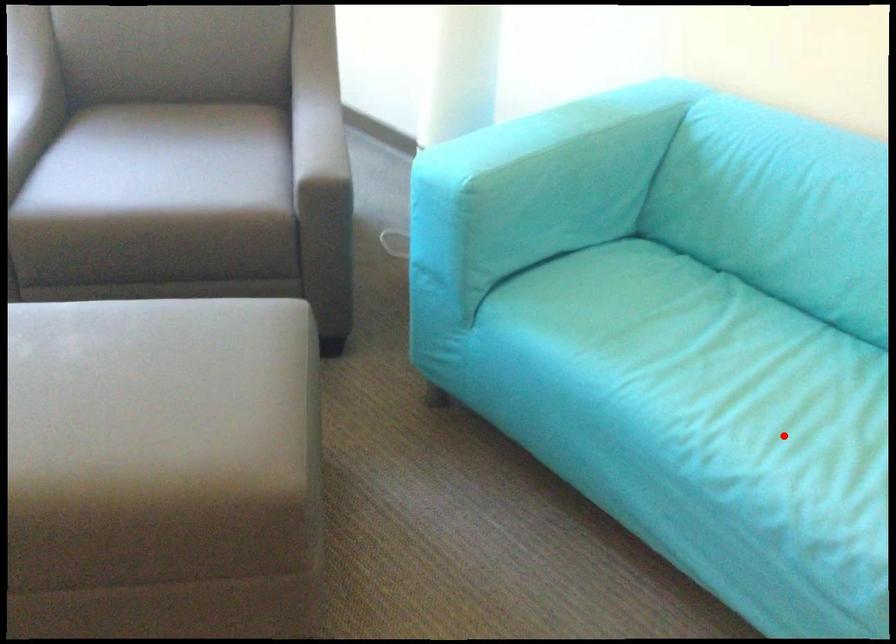
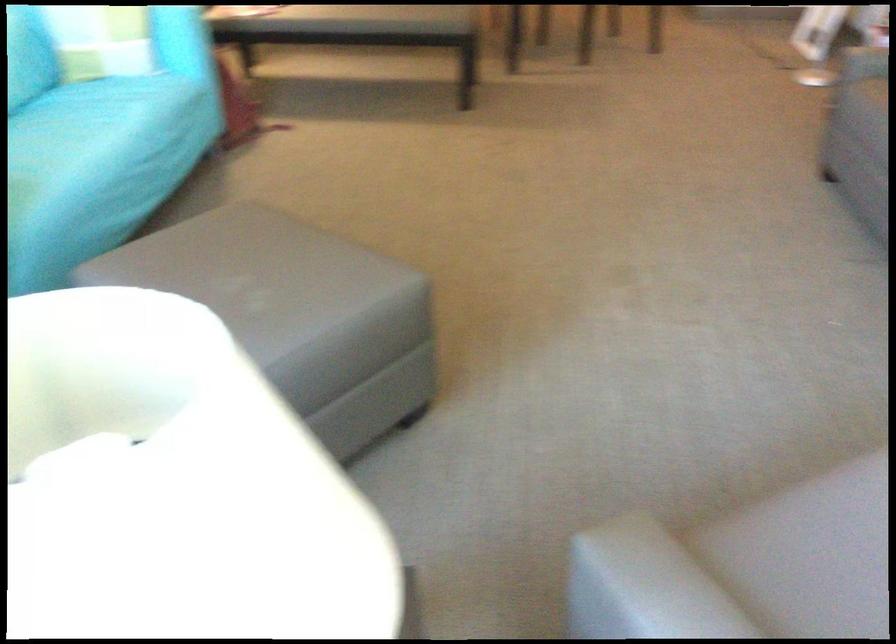
Where in the second image is the point corresponding to the highlighted location from the first image?

(87, 134)